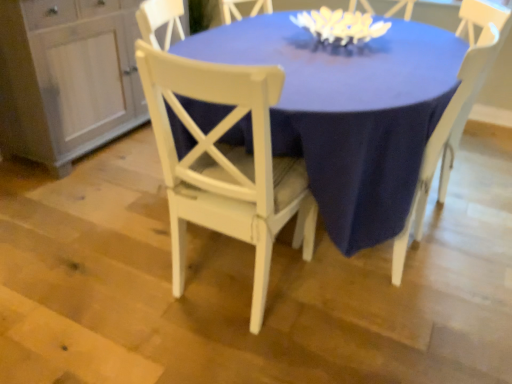
Question: Is white wood dresser at left inside or outside of matte white table at center?

Choices:
 (A) inside
 (B) outside

Answer: (B)

Question: Considering the positions of white wood dresser at left and matte white table at center in the image, is white wood dresser at left wider or thinner than matte white table at center?

Choices:
 (A) thin
 (B) wide

Answer: (A)

Question: Based on their relative distances, which object is farther from the white wood chair at center, the 1th chair when ordered from right to left?

Choices:
 (A) white wood dresser at left
 (B) matte white table at center
 (C) white matte floral arrangement at upper center
 (D) white wood chair at center, positioned as the 1th chair in left-to-right order

Answer: (A)

Question: Which is farther from the matte white table at center?

Choices:
 (A) white wood chair at center, which ranks as the 2th chair in left-to-right order
 (B) white wood dresser at left
 (C) white wood chair at center, the second chair when ordered from right to left
 (D) white matte floral arrangement at upper center

Answer: (B)